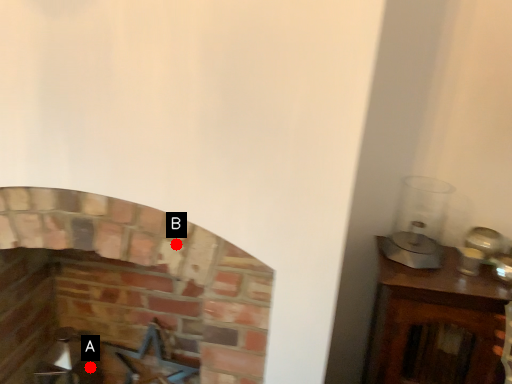
Question: Two points are circled on the image, labeled by A and B beside each circle. Which point is further to the camera?

Choices:
 (A) A is further
 (B) B is further

Answer: (A)